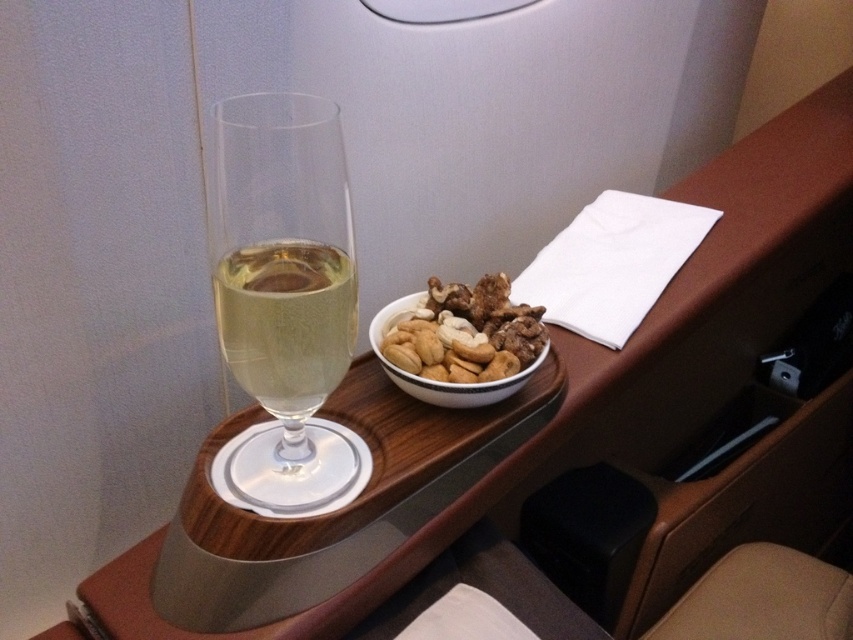
Identify the location of clear glass at center. (286, 321).

Measure the distance between clear glass at center and camera.

17.74 inches

Find the location of a particular element. The width and height of the screenshot is (853, 640). clear glass at center is located at coordinates (286, 321).

Does clear glass wine glass at center have a greater width compared to shiny brown bowl at center?

Incorrect, clear glass wine glass at center's width does not surpass shiny brown bowl at center's.

Where is `clear glass wine glass at center`? Image resolution: width=853 pixels, height=640 pixels. clear glass wine glass at center is located at coordinates (283, 291).

Does clear glass wine glass at center appear under clear glass at center?

Actually, clear glass wine glass at center is above clear glass at center.

From the picture: Does clear glass wine glass at center have a smaller size compared to clear glass at center?

No.

Is point (282, 353) less distant than point (326, 336)?

Yes, it is in front of point (326, 336).

Locate an element on the screen. clear glass wine glass at center is located at coordinates (283, 291).